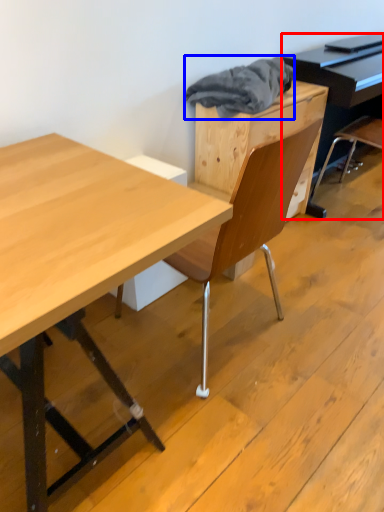
Question: Which of the following is the closest to the observer, piano (highlighted by a red box) or material (highlighted by a blue box)?

Choices:
 (A) piano
 (B) material

Answer: (B)